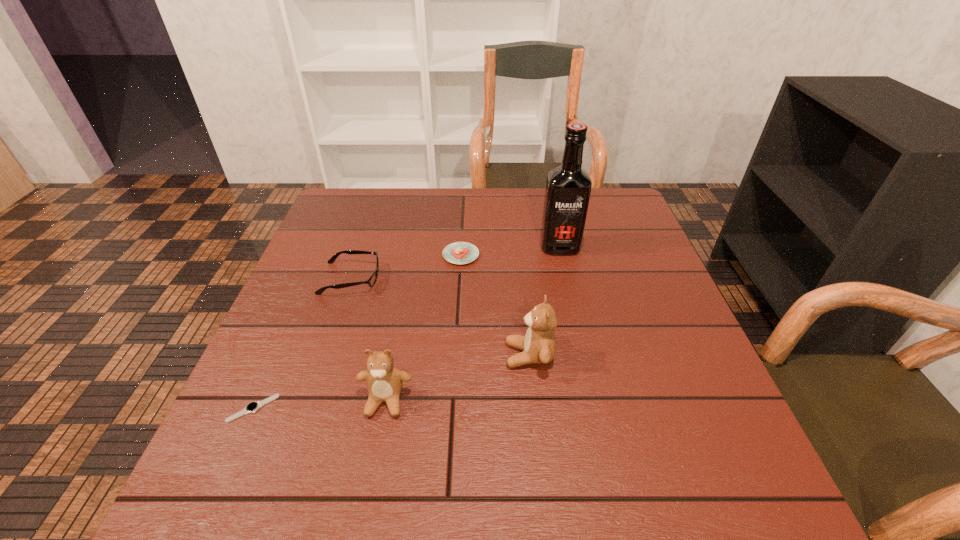
Locate an element on the screen. This screenshot has height=540, width=960. spectacles that is positioned at the left edge is located at coordinates (371, 281).

You are a GUI agent. You are given a task and a screenshot of the screen. Output one action in this format:
    pyautogui.click(x=<x>, y=<y>)
    Task: Click on the watch that is positioned at the left edge
    The width and height of the screenshot is (960, 540).
    Given the screenshot: What is the action you would take?
    pyautogui.click(x=252, y=407)

This screenshot has height=540, width=960. In order to click on object present at the near left corner in this screenshot , I will do `click(252, 407)`.

You are a GUI agent. You are given a task and a screenshot of the screen. Output one action in this format:
    pyautogui.click(x=<x>, y=<y>)
    Task: Click on the free space at the far edge
    
    Given the screenshot: What is the action you would take?
    pyautogui.click(x=539, y=215)

Locate an element on the screen. The height and width of the screenshot is (540, 960). free region at the near edge of the desktop is located at coordinates (500, 406).

Identify the location of vacant area at the left edge of the desktop. (296, 278).

Find the location of `free space at the right edge`. free space at the right edge is located at coordinates (676, 389).

This screenshot has height=540, width=960. What are the coordinates of `vacant space at the far left corner` in the screenshot? It's located at (378, 195).

Find the location of a particular element. vacant area at the far right corner is located at coordinates (589, 210).

Locate an element on the screen. Image resolution: width=960 pixels, height=540 pixels. vacant space at the near right corner is located at coordinates (723, 408).